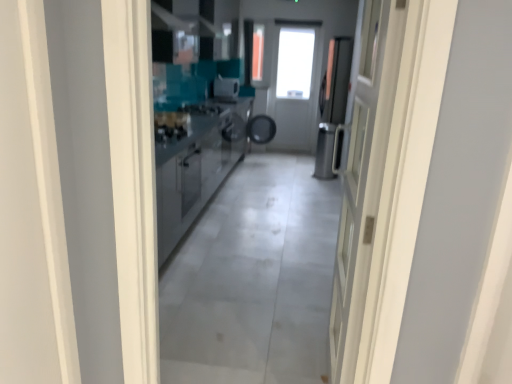
Question: Does stainless steel cabinetry at center have a smaller size compared to satin silver toaster at center?

Choices:
 (A) yes
 (B) no

Answer: (B)

Question: Would you say stainless steel cabinetry at center contains satin silver toaster at center?

Choices:
 (A) yes
 (B) no

Answer: (B)

Question: Considering the relative positions of stainless steel cabinetry at center and satin silver toaster at center in the image provided, is stainless steel cabinetry at center to the left of satin silver toaster at center from the viewer's perspective?

Choices:
 (A) yes
 (B) no

Answer: (A)

Question: Is stainless steel cabinetry at center at the right side of satin silver toaster at center?

Choices:
 (A) yes
 (B) no

Answer: (B)

Question: Is stainless steel cabinetry at center facing away from satin silver toaster at center?

Choices:
 (A) yes
 (B) no

Answer: (B)

Question: From the image's perspective, relative to satin silver dishwasher at center, is stainless steel cabinetry at center above or below?

Choices:
 (A) below
 (B) above

Answer: (A)

Question: From a real-world perspective, is stainless steel cabinetry at center positioned above or below satin silver dishwasher at center?

Choices:
 (A) above
 (B) below

Answer: (A)

Question: In the image, is stainless steel cabinetry at center on the left side or the right side of satin silver dishwasher at center?

Choices:
 (A) left
 (B) right

Answer: (A)

Question: Is stainless steel cabinetry at center situated inside satin silver dishwasher at center or outside?

Choices:
 (A) outside
 (B) inside

Answer: (A)

Question: In the image, is stainless steel cabinetry at center positioned in front of or behind white glossy door at right?

Choices:
 (A) front
 (B) behind

Answer: (B)

Question: Is point (196, 195) positioned closer to the camera than point (351, 170)?

Choices:
 (A) closer
 (B) farther

Answer: (B)

Question: Is stainless steel cabinetry at center wider or thinner than white glossy door at right?

Choices:
 (A) wide
 (B) thin

Answer: (A)

Question: Is stainless steel cabinetry at center taller or shorter than white glossy door at right?

Choices:
 (A) short
 (B) tall

Answer: (A)

Question: Is point (338, 225) closer or farther from the camera than point (222, 84)?

Choices:
 (A) farther
 (B) closer

Answer: (B)

Question: Considering their positions, is white glossy door at right located in front of or behind satin silver toaster at center?

Choices:
 (A) front
 (B) behind

Answer: (A)